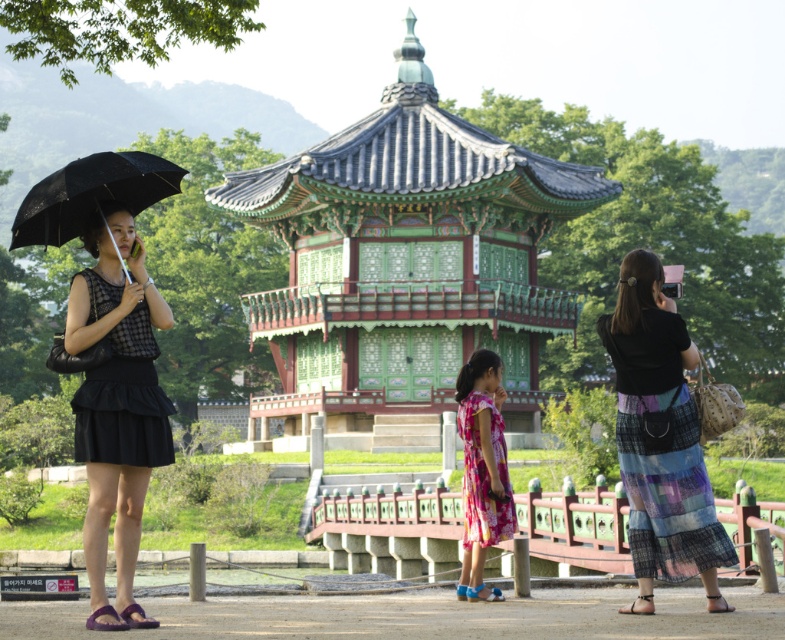
Between green lacquered wood gazebo at center and black matte umbrella at left, which one is positioned higher?

green lacquered wood gazebo at center is above.

Which is behind, point (535, 161) or point (148, 170)?

The point (535, 161) is more distant.

Locate an element on the screen. This screenshot has height=640, width=785. green lacquered wood gazebo at center is located at coordinates (406, 264).

Does black matte dress at left appear under floral silk dress at center?

Actually, black matte dress at left is above floral silk dress at center.

The image size is (785, 640). Describe the element at coordinates (117, 406) in the screenshot. I see `black matte dress at left` at that location.

The width and height of the screenshot is (785, 640). What do you see at coordinates (117, 406) in the screenshot?
I see `black matte dress at left` at bounding box center [117, 406].

Image resolution: width=785 pixels, height=640 pixels. In order to click on black matte dress at left in this screenshot , I will do `click(117, 406)`.

Which of these two, multicolored woven skirt at right or black matte umbrella at left, stands taller?

multicolored woven skirt at right

Which is below, multicolored woven skirt at right or black matte umbrella at left?

Positioned lower is multicolored woven skirt at right.

Which is behind, point (623, 356) or point (104, 177)?

Point (623, 356)

Where is `multicolored woven skirt at right`? multicolored woven skirt at right is located at coordinates (659, 440).